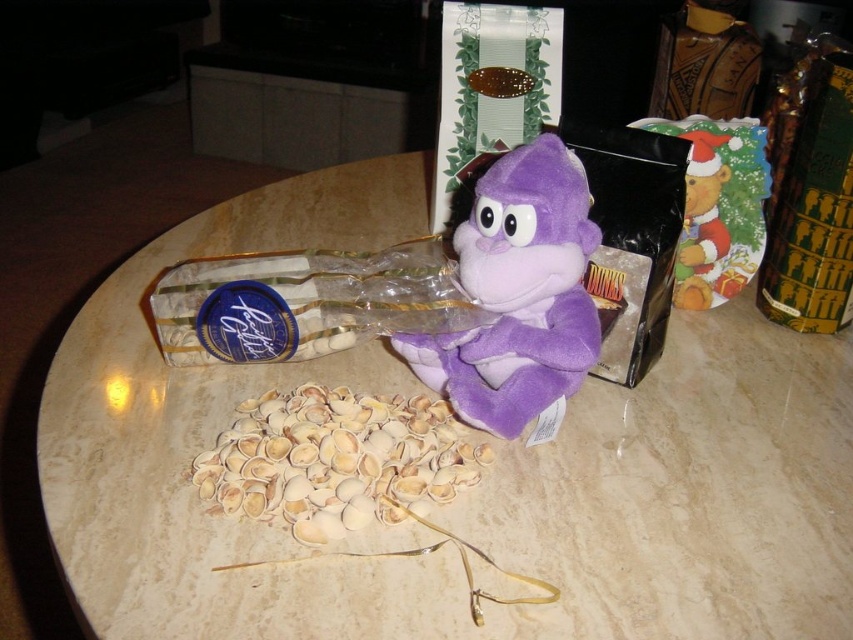
Question: Can you confirm if purple plush monkey at center is thinner than light beige shell at center?

Choices:
 (A) yes
 (B) no

Answer: (A)

Question: Among these points, which one is nearest to the camera?

Choices:
 (A) (128, 515)
 (B) (561, 163)
 (C) (431, 452)

Answer: (A)

Question: Does purple plush monkey at center have a smaller size compared to light beige shell at center?

Choices:
 (A) no
 (B) yes

Answer: (A)

Question: Among these points, which one is farthest from the camera?

Choices:
 (A) (132, 369)
 (B) (320, 412)
 (C) (560, 369)

Answer: (A)

Question: Is the position of marble table at center more distant than that of purple plush monkey at center?

Choices:
 (A) no
 (B) yes

Answer: (A)

Question: Considering the real-world distances, which object is closest to the light beige shell at center?

Choices:
 (A) marble table at center
 (B) purple plush monkey at center

Answer: (B)